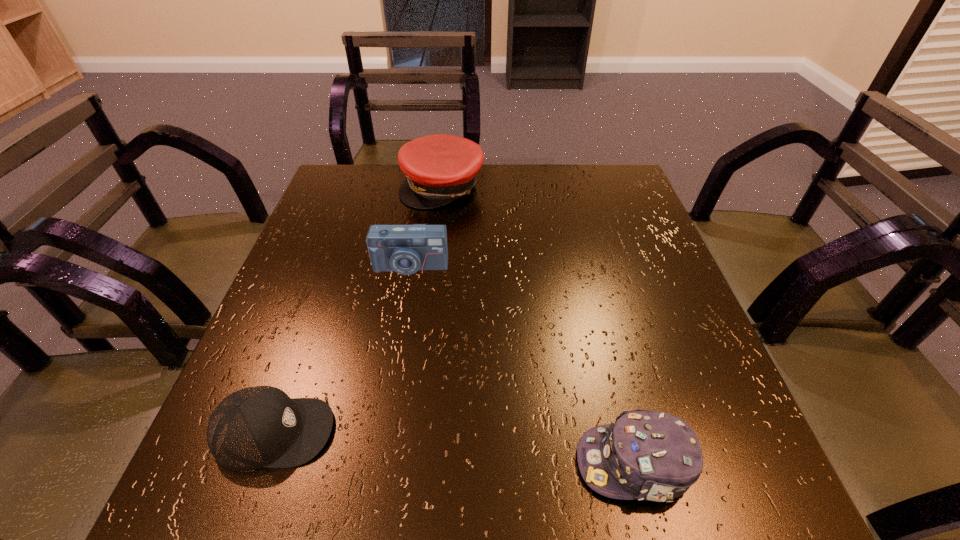
You are a GUI agent. You are given a task and a screenshot of the screen. Output one action in this format:
    pyautogui.click(x=<x>, y=<y>)
    Task: Click on the free location located on the front-facing side of the rightmost object
    
    Given the screenshot: What is the action you would take?
    click(x=405, y=463)

You are a GUI agent. You are given a task and a screenshot of the screen. Output one action in this format:
    pyautogui.click(x=<x>, y=<y>)
    Task: Click on the object situated at the far edge
    This screenshot has height=540, width=960.
    Given the screenshot: What is the action you would take?
    pyautogui.click(x=440, y=168)

Locate an element on the screen. This screenshot has height=540, width=960. object that is at the left edge is located at coordinates (255, 427).

You are a GUI agent. You are given a task and a screenshot of the screen. Output one action in this format:
    pyautogui.click(x=<x>, y=<y>)
    Task: Click on the object positioned at the right edge
    This screenshot has height=540, width=960.
    Given the screenshot: What is the action you would take?
    pyautogui.click(x=646, y=455)

Identify the location of object that is at the near left corner. The image size is (960, 540). (255, 427).

Identify the location of object positioned at the near right corner. (646, 455).

In the image, there is a desktop. Identify the location of vacant space at the far edge. (551, 176).

In the image, there is a desktop. At what (x,y) coordinates should I click in order to perform the action: click on vacant space at the near edge. Please return your answer as a coordinate pair (x, y). This screenshot has width=960, height=540. Looking at the image, I should click on (411, 476).

Locate an element on the screen. This screenshot has height=540, width=960. free space at the left edge of the desktop is located at coordinates (264, 345).

Identify the location of vacant space at the right edge of the desktop. (612, 241).